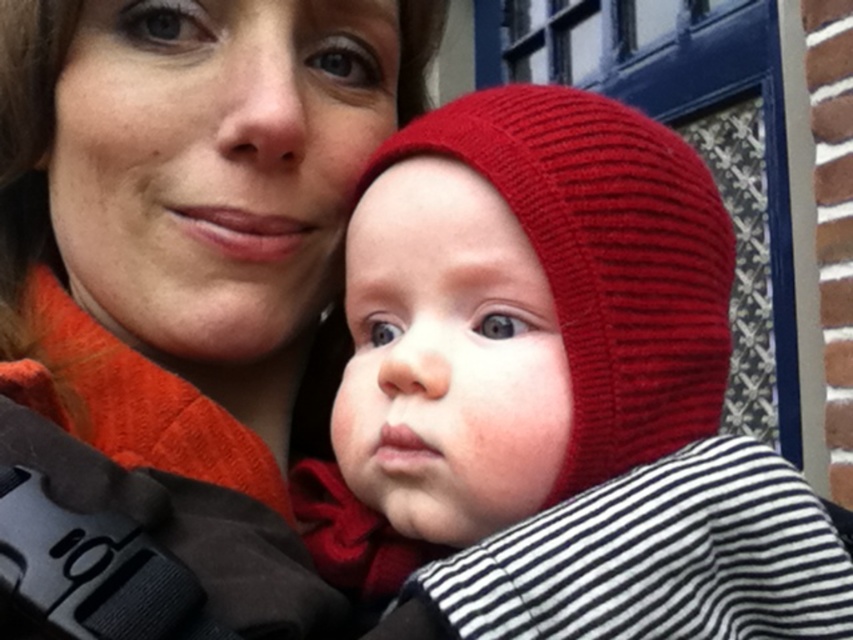
Question: Does matte orange sweater at upper left have a smaller size compared to knitted red hat at center?

Choices:
 (A) yes
 (B) no

Answer: (B)

Question: Which point is closer to the camera taking this photo?

Choices:
 (A) (648, 396)
 (B) (270, 600)

Answer: (B)

Question: Is matte orange sweater at upper left to the left of knitted red hat at center from the viewer's perspective?

Choices:
 (A) no
 (B) yes

Answer: (B)

Question: Can you confirm if matte orange sweater at upper left is positioned below knitted red hat at center?

Choices:
 (A) no
 (B) yes

Answer: (A)